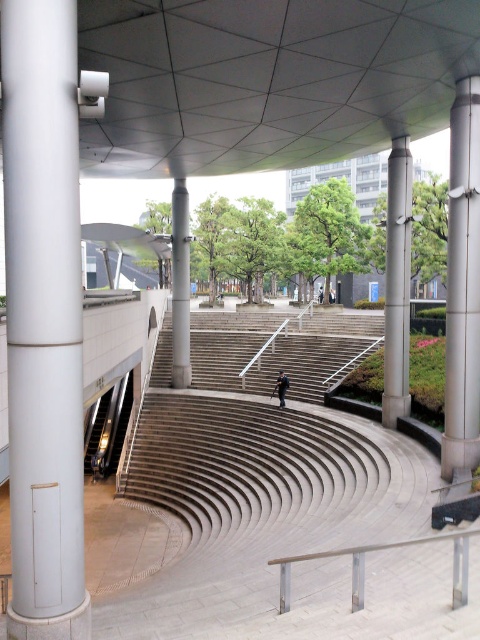
Is point (226, 333) positioned after point (402, 228)?

Yes, point (226, 333) is farther from viewer.

At what (x,y) coordinates should I click in order to perform the action: click on smooth concrete stairs at center. Please return your answer as a coordinate pair (x, y). The height and width of the screenshot is (640, 480). Looking at the image, I should click on (275, 349).

At what (x,y) coordinates should I click in order to perform the action: click on smooth concrete stairs at center. Please return your answer as a coordinate pair (x, y). The width and height of the screenshot is (480, 640). Looking at the image, I should click on (275, 349).

Consider the image. Is white glossy column at left further to camera compared to satin silver pole at center right?

No, white glossy column at left is closer to the viewer.

Can you confirm if white glossy column at left is bigger than satin silver pole at center right?

Correct, white glossy column at left is larger in size than satin silver pole at center right.

Find the location of `white glossy column at left`. white glossy column at left is located at coordinates (44, 320).

Between point (272, 564) and point (283, 397), which one is positioned in front?

Positioned in front is point (272, 564).

This screenshot has height=640, width=480. Find the location of `silver metallic rail at lower center`. silver metallic rail at lower center is located at coordinates (379, 550).